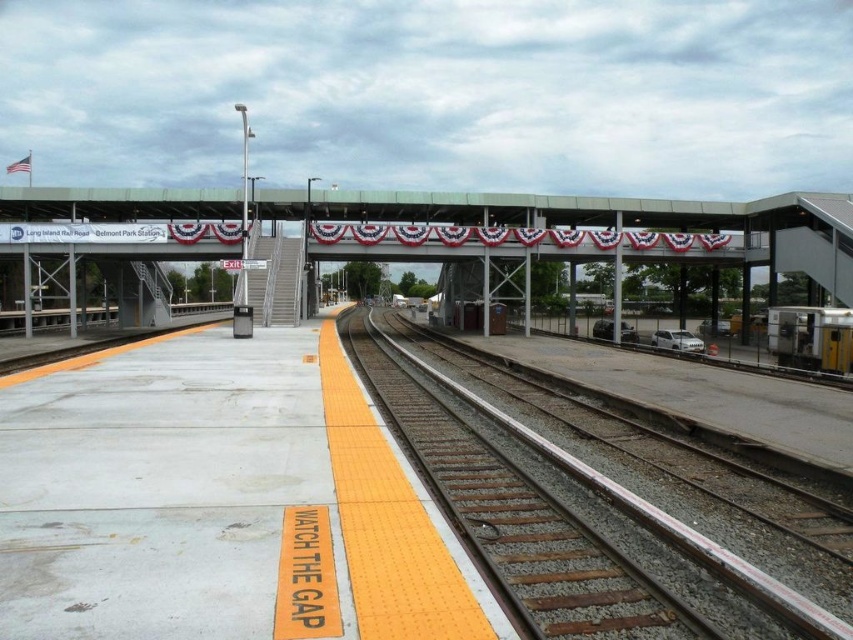
Question: Which point is farther to the camera?

Choices:
 (A) (798, 323)
 (B) (372, 333)

Answer: (B)

Question: Can you confirm if rusty metal train track at center is positioned below yellow metallic train at right?

Choices:
 (A) yes
 (B) no

Answer: (A)

Question: Which is nearer to the concrete platform at center?

Choices:
 (A) yellow tactile paving at center
 (B) rusty metal train track at center
 (C) yellow metallic train at right

Answer: (A)

Question: Does yellow tactile paving at center have a smaller size compared to yellow metallic train at right?

Choices:
 (A) no
 (B) yes

Answer: (A)

Question: Which of the following is the closest to the observer?

Choices:
 (A) (363, 625)
 (B) (250, 509)
 (C) (527, 616)

Answer: (A)

Question: Is yellow tactile paving at center in front of yellow metallic train at right?

Choices:
 (A) no
 (B) yes

Answer: (B)